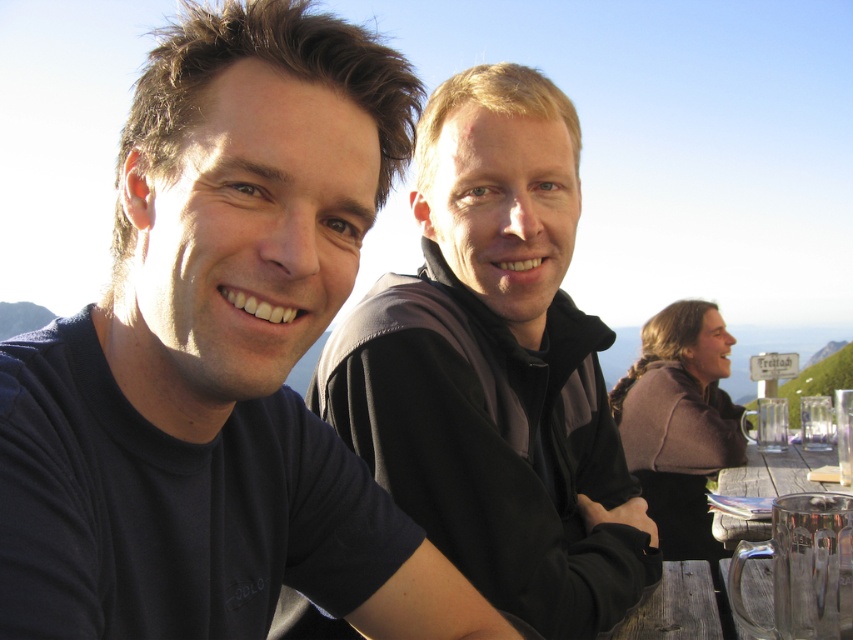
Does dark blue t-shirt at left have a greater height compared to wooden table at lower center?

Yes.

Is point (9, 371) positioned in front of point (698, 573)?

Yes, it is in front of point (698, 573).

You are a GUI agent. You are given a task and a screenshot of the screen. Output one action in this format:
    pyautogui.click(x=<x>, y=<y>)
    Task: Click on the dark blue t-shirt at left
    This screenshot has width=853, height=640.
    Given the screenshot: What is the action you would take?
    pyautogui.click(x=219, y=360)

Who is taller, matte black jacket at center or wooden table at lower center?

Standing taller between the two is matte black jacket at center.

Does point (556, 593) come farther from viewer compared to point (619, 627)?

No.

Which is in front, point (618, 548) or point (715, 589)?

Point (618, 548) is in front.

Where is `matte black jacket at center`? This screenshot has height=640, width=853. matte black jacket at center is located at coordinates (496, 369).

Between wooden table at lower center and wooden table at lower right, which one is positioned higher?

wooden table at lower right

Does wooden table at lower center appear over wooden table at lower right?

No, wooden table at lower center is not above wooden table at lower right.

What do you see at coordinates (677, 605) in the screenshot? I see `wooden table at lower center` at bounding box center [677, 605].

Where is `wooden table at lower center`? The height and width of the screenshot is (640, 853). wooden table at lower center is located at coordinates (677, 605).